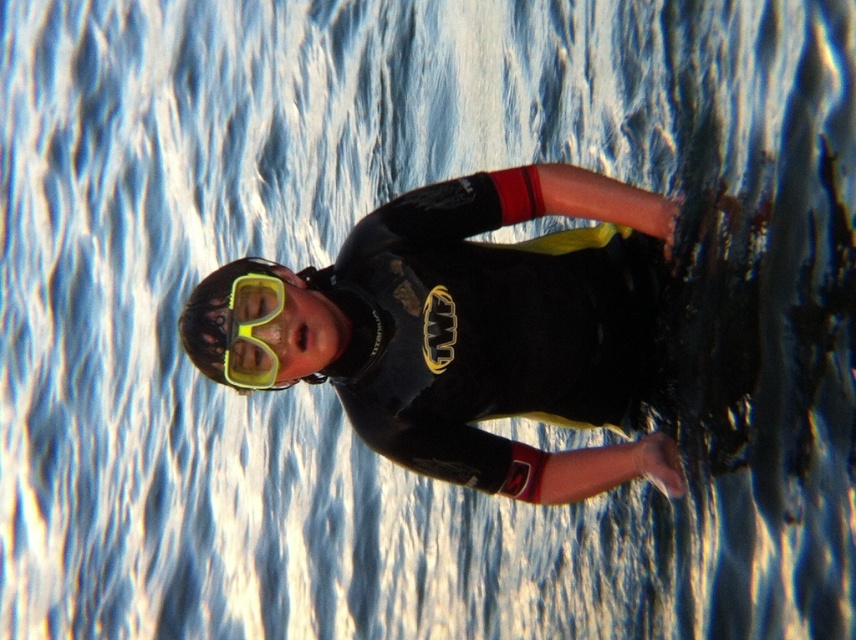
Question: Among these points, which one is farthest from the camera?

Choices:
 (A) [247, 340]
 (B) [450, 308]

Answer: (B)

Question: Does black matte wetsuit at center have a lesser width compared to yellow matte/glossy goggles at center?

Choices:
 (A) no
 (B) yes

Answer: (A)

Question: Is black matte wetsuit at center behind yellow matte/glossy goggles at center?

Choices:
 (A) yes
 (B) no

Answer: (A)

Question: Which of the following is the closest to the observer?

Choices:
 (A) (614, 419)
 (B) (257, 273)

Answer: (B)

Question: Is black matte wetsuit at center smaller than yellow matte/glossy goggles at center?

Choices:
 (A) yes
 (B) no

Answer: (B)